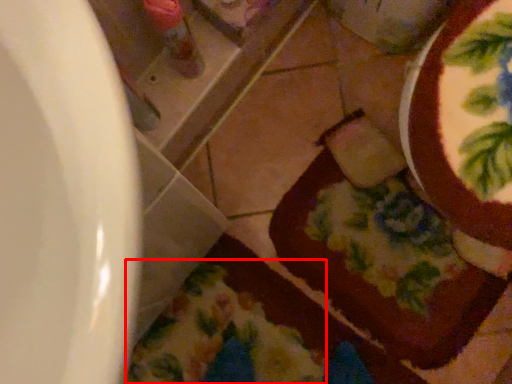
Question: Considering the relative positions of blanket (annotated by the red box) and chocolate cake in the image provided, where is blanket (annotated by the red box) located with respect to the staircase?

Choices:
 (A) right
 (B) left

Answer: (B)